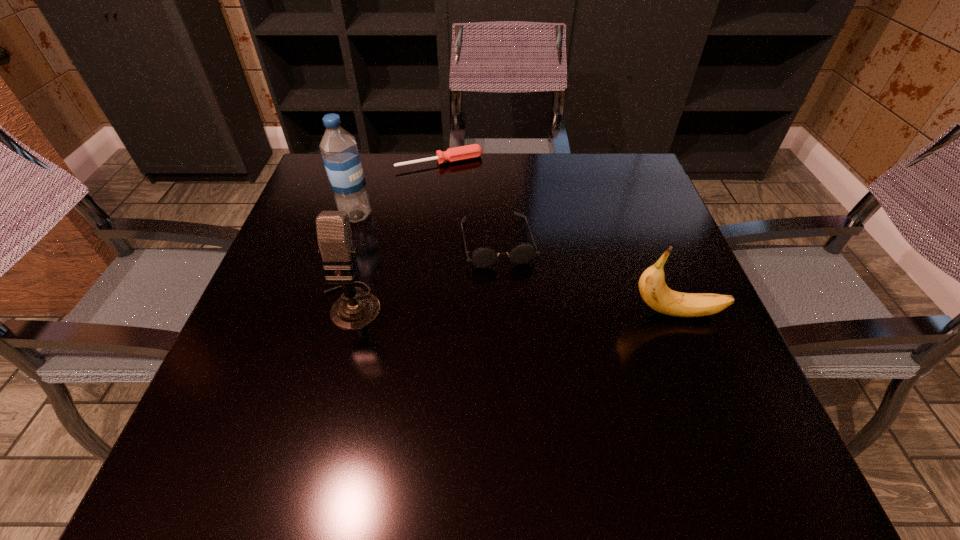
Locate an element on the screen. The image size is (960, 540). blank space at the far edge of the desktop is located at coordinates coord(532,199).

You are a GUI agent. You are given a task and a screenshot of the screen. Output one action in this format:
    pyautogui.click(x=<x>, y=<y>)
    Task: Click on the vacant area at the near edge of the desktop
    
    Given the screenshot: What is the action you would take?
    pyautogui.click(x=587, y=388)

What are the coordinates of `free region at the left edge` in the screenshot? It's located at (296, 252).

Identify the location of free region at the right edge of the desktop. The height and width of the screenshot is (540, 960). (642, 335).

This screenshot has height=540, width=960. What are the coordinates of `free space at the far right corner of the desktop` in the screenshot? It's located at (587, 167).

This screenshot has width=960, height=540. I want to click on free space between the sunglasses and the farthest object, so click(x=468, y=201).

Locate an element on the screen. The width and height of the screenshot is (960, 540). vacant space that is in between the water bottle and the shortest object is located at coordinates (397, 188).

Identify the location of vacant point located between the rightmost object and the second shortest object. This screenshot has height=540, width=960. click(x=587, y=277).

The image size is (960, 540). Identify the location of empty space that is in between the microphone and the third tallest object. (514, 309).

Identify the location of vacant area that lies between the sunglasses and the screwdriver. (468, 201).